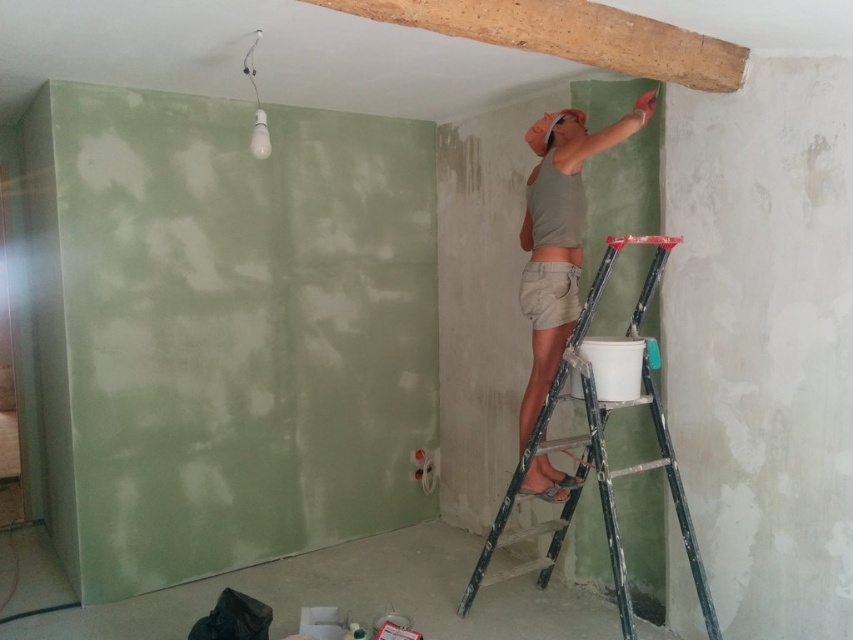
You are a contractor assessing the renovation site. You notice the wooden beam at upper center and the metallic silver ladder at upper right. Which object is smaller in size?

The wooden beam at upper center has a smaller size compared to the metallic silver ladder at upper right, so the wooden beam at upper center is smaller.

You are a contractor inspecting the renovation site. You notice the wooden beam at upper center and the matte green shorts at center. Which object is located to the left of the other?

The wooden beam at upper center is positioned on the left side of matte green shorts at center.